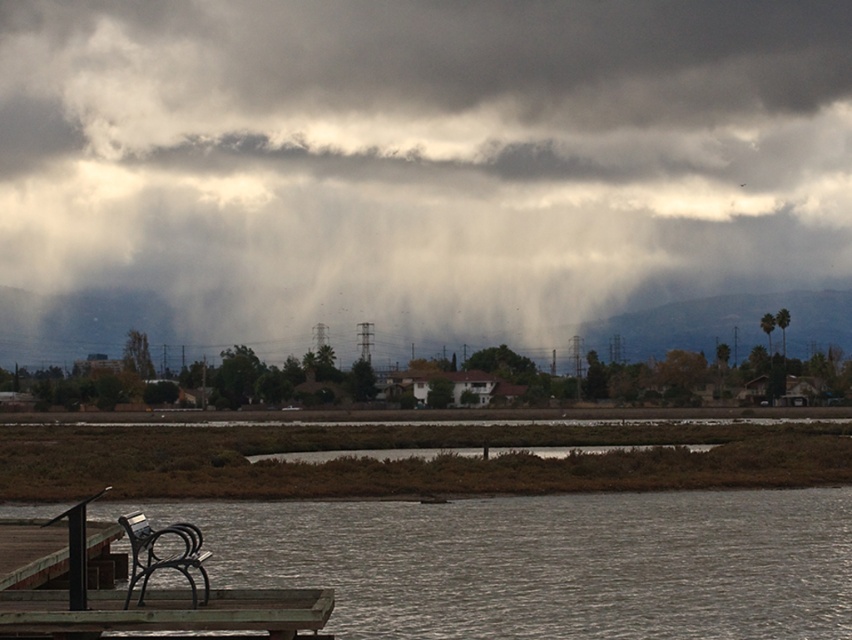
Is brown wooden picnic table at lower left shorter than wooden dock at lower left?

Yes, brown wooden picnic table at lower left is shorter than wooden dock at lower left.

Can you confirm if brown wooden picnic table at lower left is taller than wooden dock at lower left?

No, brown wooden picnic table at lower left is not taller than wooden dock at lower left.

Identify the location of brown wooden picnic table at lower left. (165, 611).

Where is `brown wooden picnic table at lower left`? The height and width of the screenshot is (640, 852). brown wooden picnic table at lower left is located at coordinates (165, 611).

Is grayish water at lower left shorter than wooden dock at lower left?

No.

Which is in front, point (636, 536) or point (102, 529)?

Point (102, 529) is in front.

Identify the location of grayish water at lower left. (545, 561).

The height and width of the screenshot is (640, 852). What do you see at coordinates (165, 611) in the screenshot? I see `brown wooden picnic table at lower left` at bounding box center [165, 611].

Is point (85, 609) positioned before point (190, 563)?

Yes, it is.

Is point (298, 616) positioned after point (196, 548)?

No, (298, 616) is closer to viewer.

This screenshot has width=852, height=640. I want to click on brown wooden picnic table at lower left, so click(165, 611).